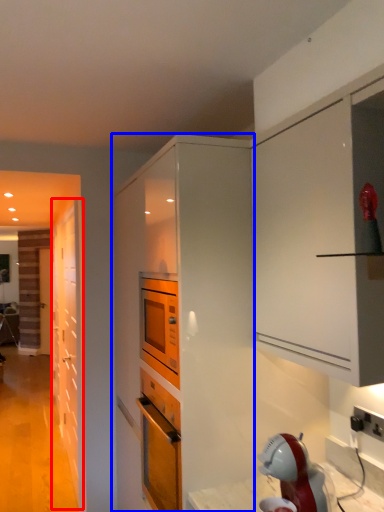
Question: Which object appears closest to the camera in this image, door (highlighted by a red box) or cabinetry (highlighted by a blue box)?

Choices:
 (A) door
 (B) cabinetry

Answer: (B)